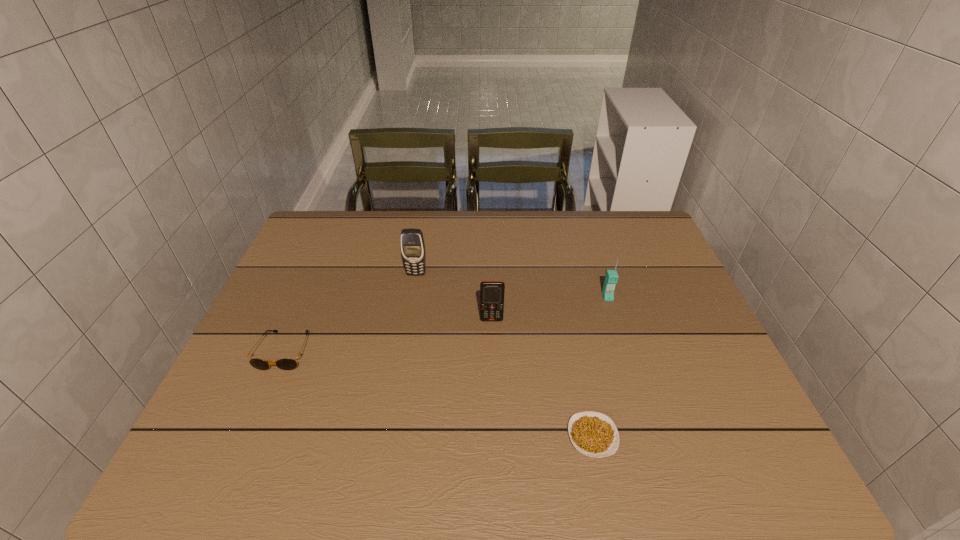
Identify the location of free region located 0.230m on the front face of the farthest cellular telephone. (406, 336).

The width and height of the screenshot is (960, 540). I want to click on vacant space positioned on the screen of the second cellular telephone from right to left, so click(493, 375).

Locate an element on the screen. The height and width of the screenshot is (540, 960). vacant space positioned 0.170m on the keypad of the rightmost cellular telephone is located at coordinates (624, 349).

Identify the location of vacant area situated 0.210m on the lenses of the second nearest object. This screenshot has height=540, width=960. (238, 458).

You are a GUI agent. You are given a task and a screenshot of the screen. Output one action in this format:
    pyautogui.click(x=<x>, y=<y>)
    Task: Click on the free space located 0.280m on the right of the nearest object
    This screenshot has width=960, height=540.
    Given the screenshot: What is the action you would take?
    pyautogui.click(x=753, y=436)

Locate an element on the screen. object that is at the near edge is located at coordinates (593, 434).

The width and height of the screenshot is (960, 540). Identify the location of object that is at the left edge. (286, 363).

You are a GUI agent. You are given a task and a screenshot of the screen. Output one action in this format:
    pyautogui.click(x=<x>, y=<y>)
    Task: Click on the vacant point at the far edge
    The width and height of the screenshot is (960, 540).
    Given the screenshot: What is the action you would take?
    pyautogui.click(x=528, y=220)

This screenshot has width=960, height=540. I want to click on free space at the near edge of the desktop, so click(x=391, y=474).

I want to click on free space at the left edge, so click(260, 328).